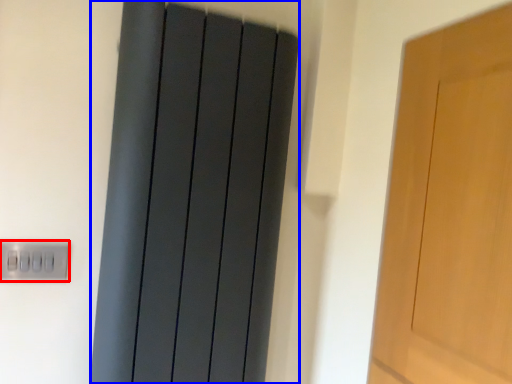
Question: Which point is further to the camera, electric outlet (highlighted by a red box) or curtain (highlighted by a blue box)?

Choices:
 (A) electric outlet
 (B) curtain

Answer: (A)